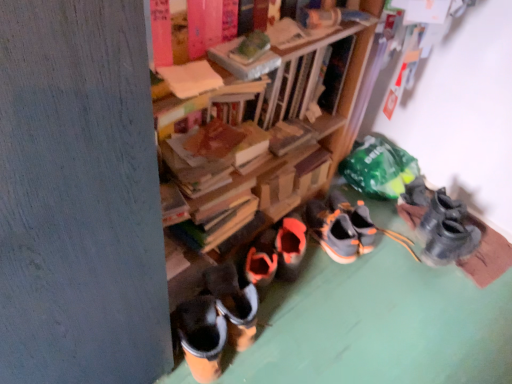
This screenshot has width=512, height=384. In order to click on vacant area that lies to the right of gray suede sneakers at center, which is counted as the 3th footwear, starting from the right in this screenshot , I will do `click(389, 247)`.